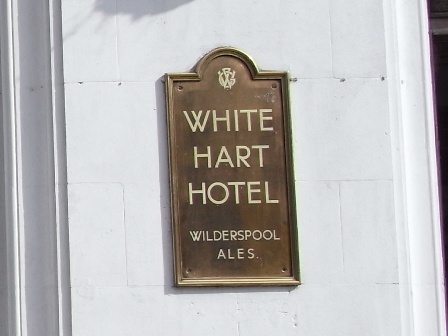
This screenshot has width=448, height=336. What are the coordinates of `gold frame` in the screenshot? It's located at (293, 220).